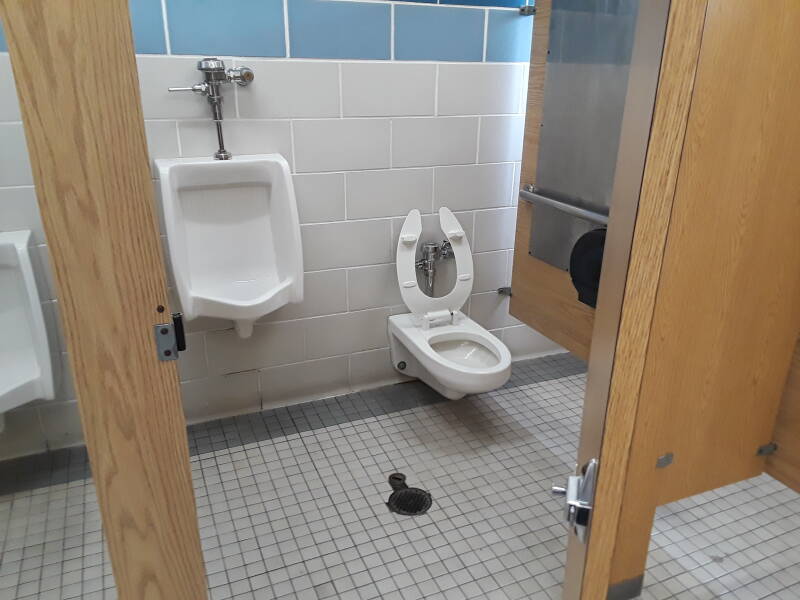
I want to click on toilet seat, so click(408, 273).